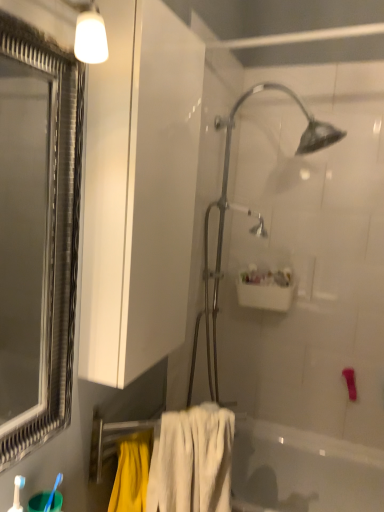
Question: From their relative heights in the image, would you say white soft towel at lower center is taller or shorter than white glossy sink at upper center?

Choices:
 (A) tall
 (B) short

Answer: (A)

Question: Is point pyautogui.click(x=228, y=497) closer or farther from the camera than point pyautogui.click(x=259, y=271)?

Choices:
 (A) closer
 (B) farther

Answer: (A)

Question: Estimate the real-world distances between objects in this image. Which object is farther from the white glossy bathtub at lower center?

Choices:
 (A) metallic frame at left
 (B) white soft towel at lower center
 (C) blue plastic toothbrush at lower left
 (D) white glossy cabinet at upper left
 (E) metallic silver shower head at center

Answer: (A)

Question: Which object is positioned farthest from the white soft towel at lower center?

Choices:
 (A) white glossy cabinet at upper left
 (B) metallic frame at left
 (C) metallic silver shower head at center
 (D) blue plastic toothbrush at lower left
 (E) white glossy bathtub at lower center

Answer: (B)